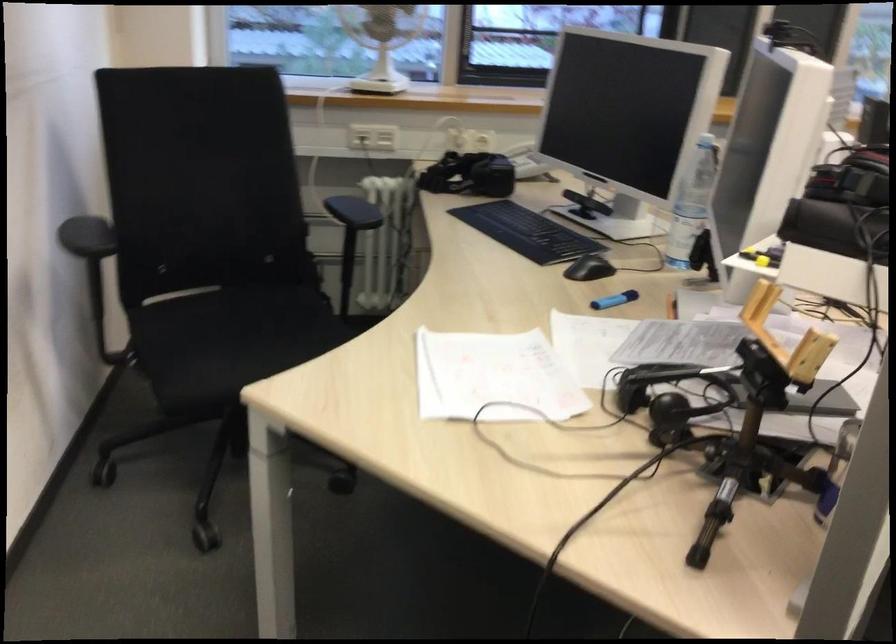
Where is `telephone handset`? The height and width of the screenshot is (644, 896). telephone handset is located at coordinates (519, 149).